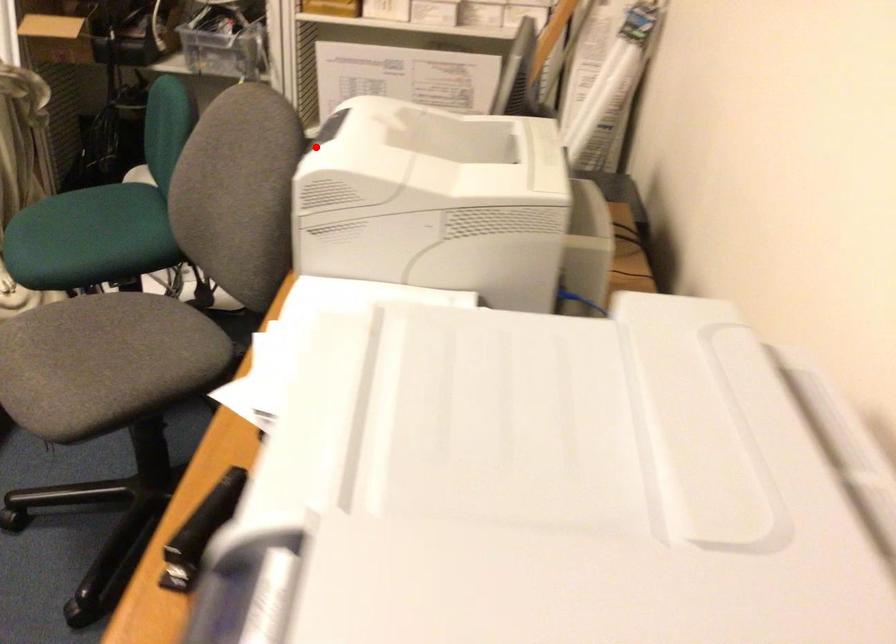
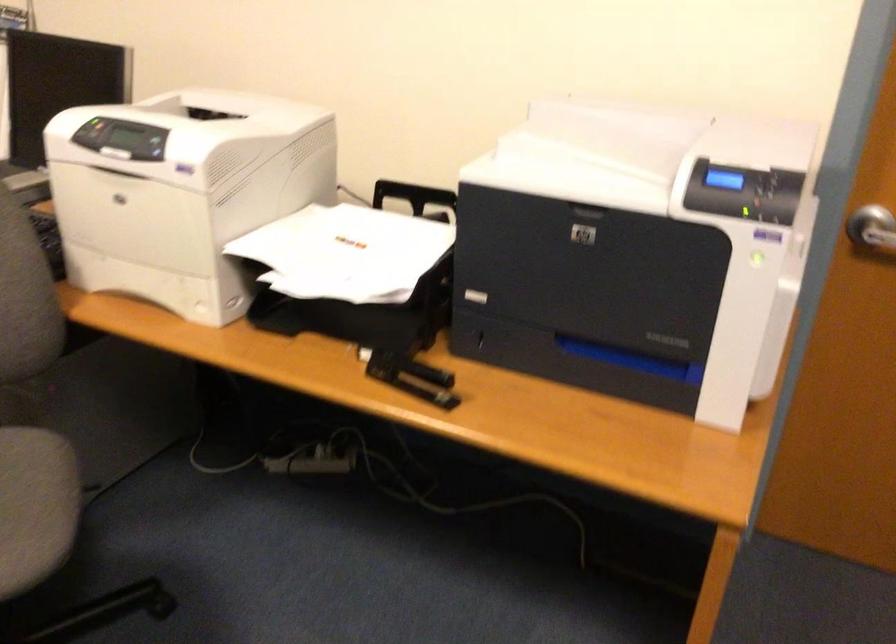
The point at the highlighted location is marked in the first image. Where is the corresponding point in the second image?

(151, 144)